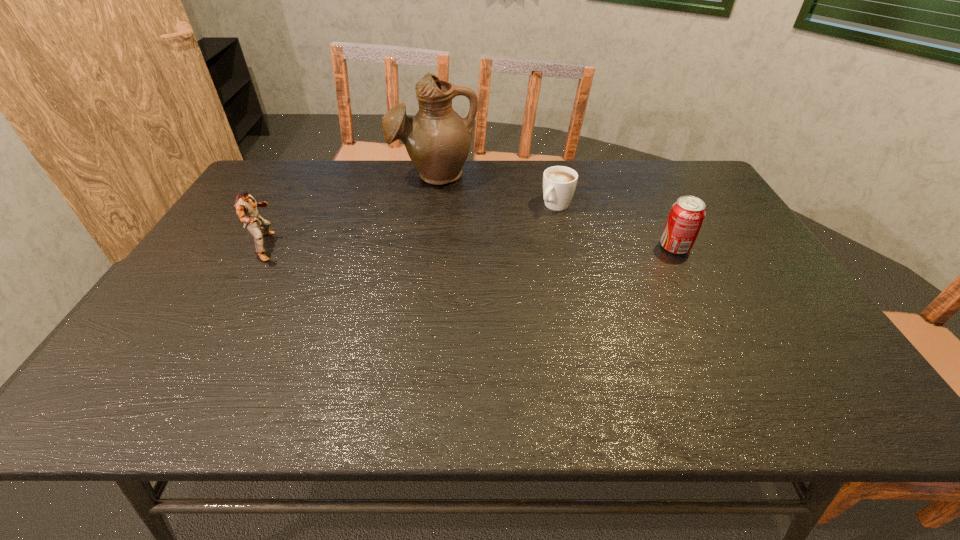
Identify the location of free space on the desktop that is between the leftmost object and the soda and is positioned with the handle on the side of the cappuccino. This screenshot has width=960, height=540. (510, 247).

The width and height of the screenshot is (960, 540). Find the location of `vacant space on the desktop that is between the puncher and the rightmost object and is positioned at the spout of the tallest object`. vacant space on the desktop that is between the puncher and the rightmost object and is positioned at the spout of the tallest object is located at coordinates pyautogui.click(x=418, y=247).